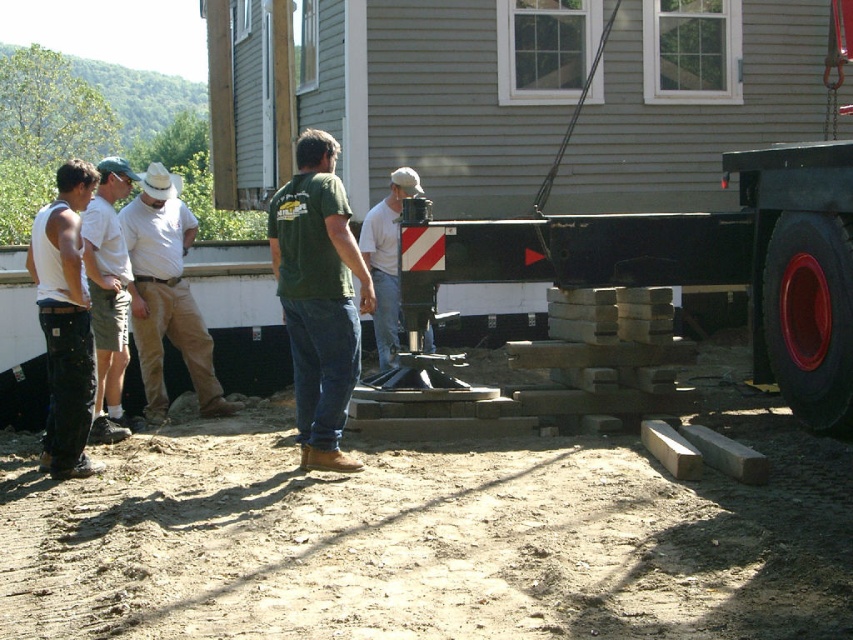
Question: Where is light brown shorts at left located in relation to white matte pole at center in the image?

Choices:
 (A) below
 (B) above

Answer: (A)

Question: Is khaki cotton pants at center to the right of white matte pole at center from the viewer's perspective?

Choices:
 (A) no
 (B) yes

Answer: (A)

Question: Which is nearer to the denim pants at left?

Choices:
 (A) khaki cotton pants at center
 (B) light brown shorts at left
 (C) green matte shirt at center

Answer: (B)

Question: Does denim pants at left appear on the right side of light brown shorts at left?

Choices:
 (A) yes
 (B) no

Answer: (B)

Question: Which of the following is the farthest from the observer?

Choices:
 (A) (293, 188)
 (B) (102, 184)

Answer: (B)

Question: Which point is closer to the camera?

Choices:
 (A) (48, 436)
 (B) (320, 410)

Answer: (B)